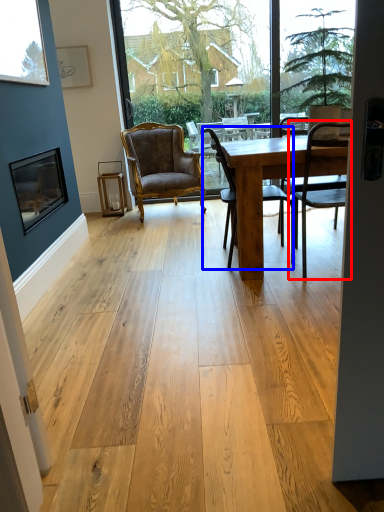
Question: Which point is closer to the camera, chair (highlighted by a red box) or chair (highlighted by a blue box)?

Choices:
 (A) chair
 (B) chair

Answer: (A)